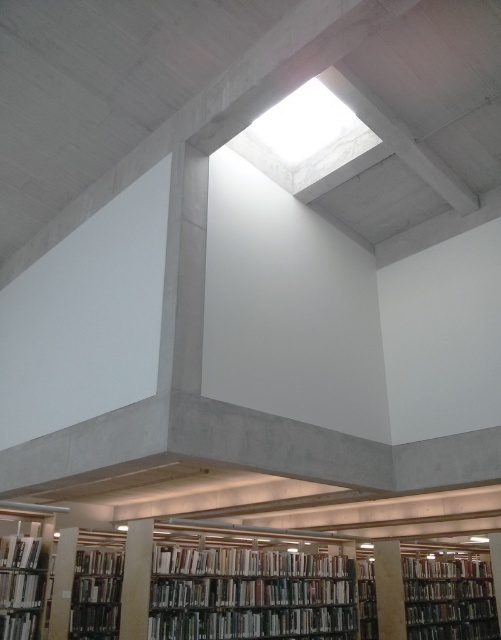
Who is more distant from viewer, (483, 557) or (260, 612)?

The point (483, 557) is behind.

Can you confirm if wooden bookcase at lower center is wider than green matte bookcase at center?

Incorrect, wooden bookcase at lower center's width does not surpass green matte bookcase at center's.

Locate an element on the screen. The height and width of the screenshot is (640, 501). wooden bookcase at lower center is located at coordinates (232, 582).

Which is below, wooden bookcase at lower center or hardcover books at lower left?

wooden bookcase at lower center is below.

Describe the element at coordinates (232, 582) in the screenshot. I see `wooden bookcase at lower center` at that location.

I want to click on wooden bookcase at lower center, so click(x=232, y=582).

Is wooden bookcase at lower center wider than hardcover book at lower left?

Incorrect, wooden bookcase at lower center's width does not surpass hardcover book at lower left's.

Does point (11, 531) come closer to viewer compared to point (3, 621)?

That is False.

Find the location of `wooden bookcase at lower center`. wooden bookcase at lower center is located at coordinates (232, 582).